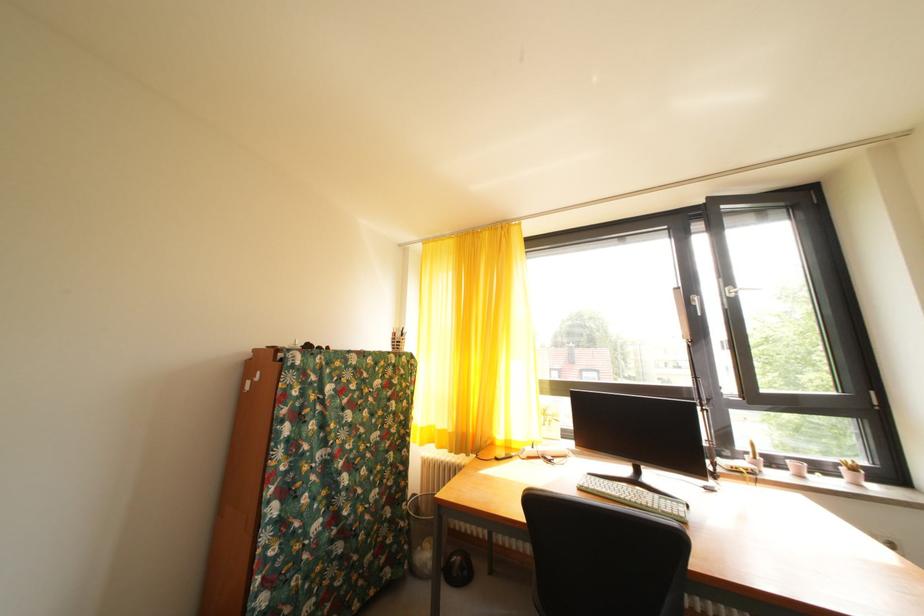
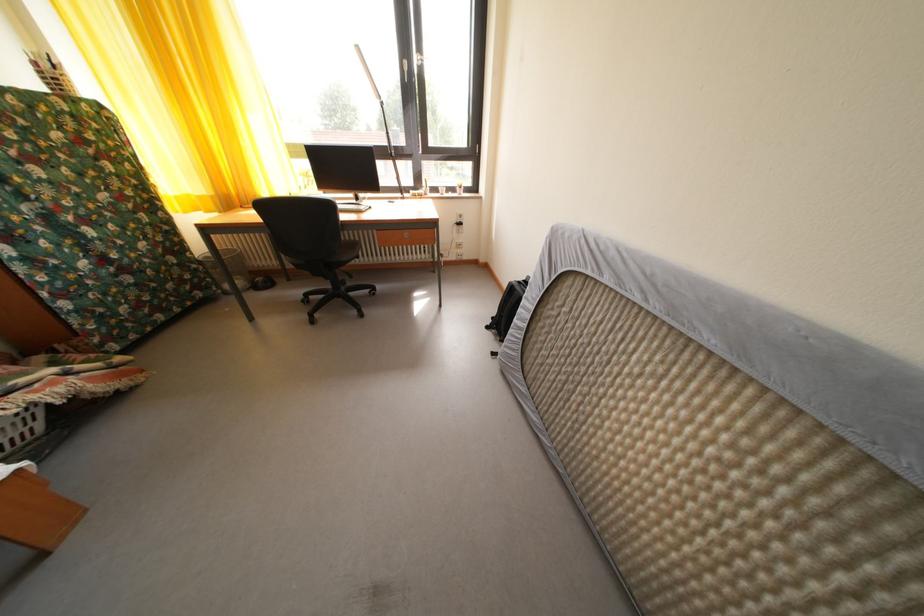
Find the pixel in the second image that matches the point at 418,538 in the first image.

(215, 278)